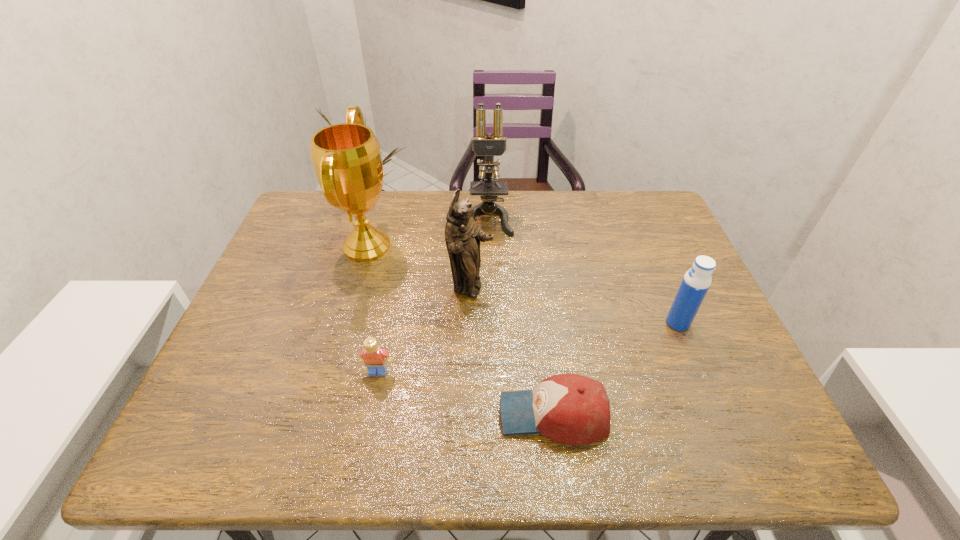
Locate an element on the screen. The height and width of the screenshot is (540, 960). free space between the third tallest object and the nearest object is located at coordinates (512, 352).

Locate an element on the screen. The width and height of the screenshot is (960, 540). empty space between the second nearest object and the microscope is located at coordinates (433, 295).

At what (x,y) coordinates should I click in order to perform the action: click on vacant area that lies between the award and the fourth shortest object. Please return your answer as a coordinate pair (x, y). The image size is (960, 540). Looking at the image, I should click on (419, 267).

Find the location of a particular element. This screenshot has height=540, width=960. empty location between the award and the microscope is located at coordinates (427, 232).

Where is `free space that is in between the fourth tallest object and the baseball cap`? Image resolution: width=960 pixels, height=540 pixels. free space that is in between the fourth tallest object and the baseball cap is located at coordinates (615, 369).

This screenshot has width=960, height=540. Find the location of `vacant space in between the baseball cap and the microscope`. vacant space in between the baseball cap and the microscope is located at coordinates (520, 316).

Select which object is the third closest to the nearest object. Please provide its 2D coordinates. Your answer should be formatted as a tuple, i.e. [(x, y)], where the tuple contains the x and y coordinates of a point satisfying the conditions above.

[(694, 286)]

Identify the location of object that is the closest to the award. (462, 235).

Identify the location of free location that satisfies the following two spatial constraints: 1. on the front-facing side of the award; 2. on the right side of the rightmost object. This screenshot has height=540, width=960. (345, 323).

This screenshot has height=540, width=960. What are the coordinates of `free space that satisfies the following two spatial constraints: 1. on the front side of the third nearest object; 2. on the front-facing side of the baseball cap` in the screenshot? It's located at (716, 415).